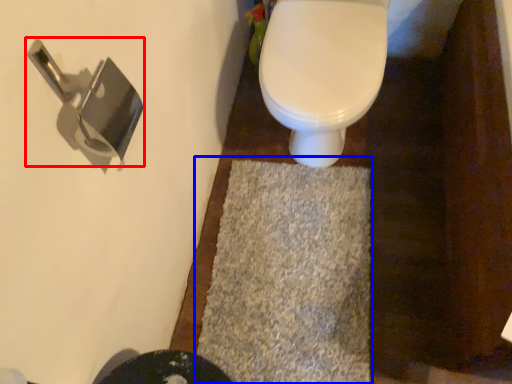
Question: Which of the following is the closest to the observer, door handle (highlighted by a red box) or bath mat (highlighted by a blue box)?

Choices:
 (A) door handle
 (B) bath mat

Answer: (A)